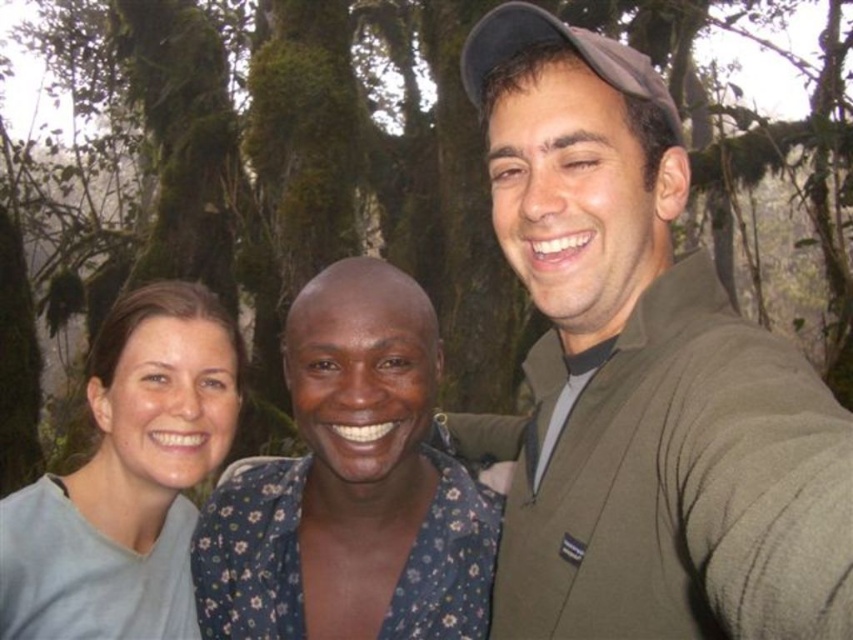
Question: Does green mossy tree at center have a lesser width compared to green sweater at center?

Choices:
 (A) no
 (B) yes

Answer: (A)

Question: Which of the following is the farthest from the observer?

Choices:
 (A) green sweater at center
 (B) green mossy tree at center
 (C) matte gray shirt at center

Answer: (C)

Question: Which is nearer to the matte gray shirt at center?

Choices:
 (A) light gray fabric at left
 (B) green mossy tree at center

Answer: (A)

Question: Is green mossy tree at center to the right of light gray fabric at left from the viewer's perspective?

Choices:
 (A) no
 (B) yes

Answer: (A)

Question: Can you confirm if green mossy tree at center is thinner than matte gray shirt at center?

Choices:
 (A) no
 (B) yes

Answer: (A)

Question: Which object appears farthest from the camera in this image?

Choices:
 (A) green sweater at center
 (B) light gray fabric at left

Answer: (B)